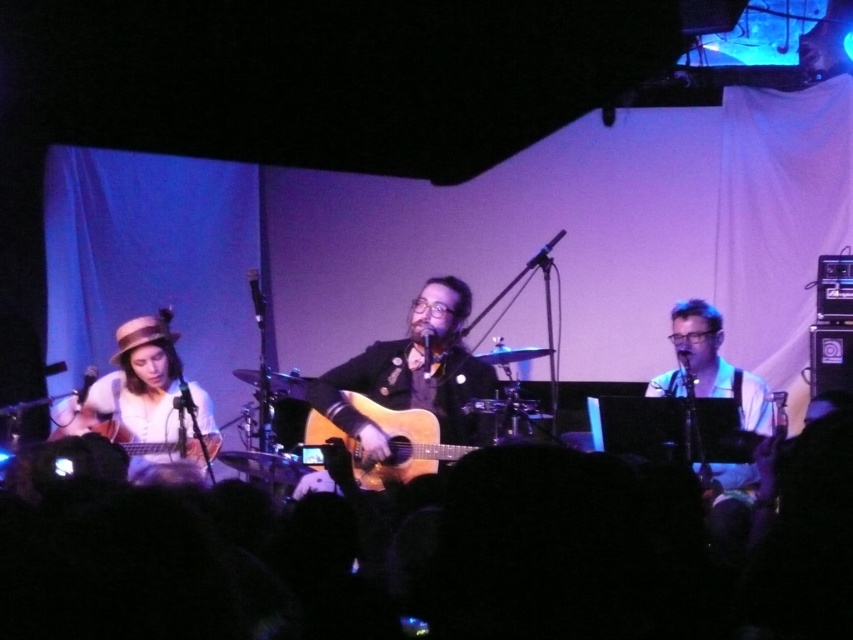
You are a photographer in the audience at the concert. You need to capture a photo that includes both the acoustic wood guitar at center and the matte wood guitar at left. Based on their sizes in the image, which guitar should you focus on first to ensure both fit in the frame?

The acoustic wood guitar at center is taller than the matte wood guitar at left, so you should focus on the acoustic wood guitar at center first to ensure both fit in the frame.

You are a photographer in the audience at the concert. You want to take a photo of the matte white shirt at left. Where should you aim your camera to capture it?

You should aim your camera at the coordinates point [148,401] to capture the matte white shirt at left.

You are a photographer in the audience at this live music performance. You want to take a photo that includes both the guitarist and the keyboardist. The guitarist is at point [137,408] and the keyboardist is at point [700,358]. Based on their positions, which musician is closer to the front of the stage?

Point [700,358] is closer to the front of the stage than point [137,408] because the description states that point [137,408] is behind point [700,358].